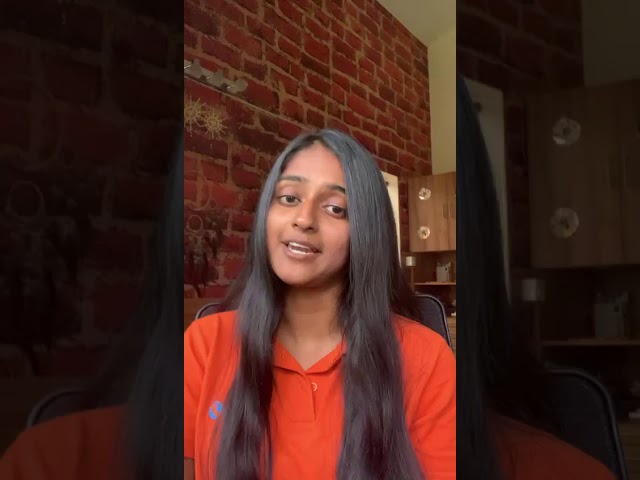
The width and height of the screenshot is (640, 480). I want to click on furniture, so click(x=444, y=193).